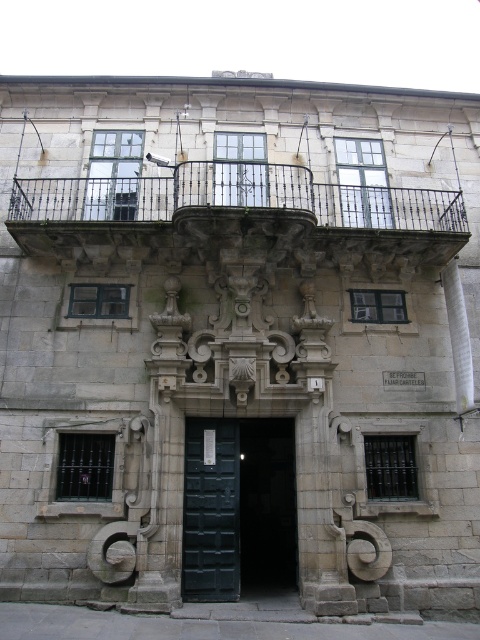
You are an architect examining the historic building. You need to determine the spatial relationship between the black wrought iron balcony at upper center and the dark green wooden door at center. Which object is located to the right of the other?

The black wrought iron balcony at upper center is positioned on the right side of dark green wooden door at center.

What is the 2D coordinate of the black wrought iron balcony at upper center in the image?

The black wrought iron balcony at upper center is located at the 2D coordinate point of [236,212].